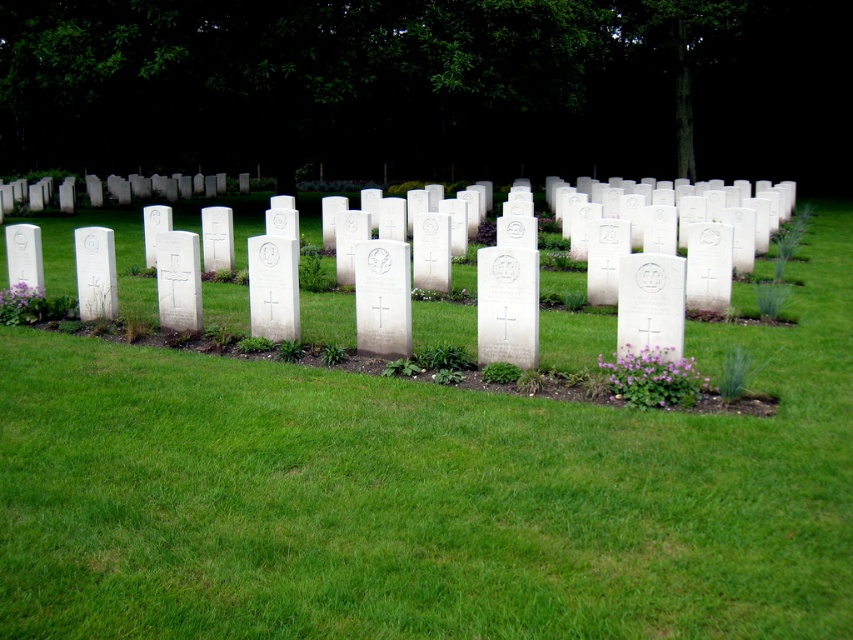
Question: Among these objects, which one is farthest from the camera?

Choices:
 (A) green grass at center
 (B) white stone cross at center

Answer: (B)

Question: Among these objects, which one is farthest from the camera?

Choices:
 (A) white marble gravestone at center-left
 (B) white stone cross at center
 (C) purple matte flower at lower right
 (D) green grass at center

Answer: (A)

Question: Can you confirm if purple matte flower at lower right is wider than white marble gravestone at center-left?

Choices:
 (A) no
 (B) yes

Answer: (B)

Question: Is green grass at center positioned before white stone cross at left?

Choices:
 (A) yes
 (B) no

Answer: (A)

Question: Which point is closer to the camera?

Choices:
 (A) white marble gravestone at center-left
 (B) purple matte flower at lower right
 (C) white stone cross at center

Answer: (B)

Question: Does green grass at center have a greater width compared to purple matte flower at lower left?

Choices:
 (A) yes
 (B) no

Answer: (A)